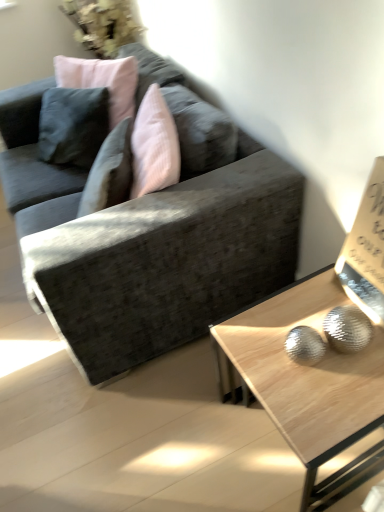
Question: Can you confirm if white paper at upper right is smaller than textured gray couch at center?

Choices:
 (A) yes
 (B) no

Answer: (A)

Question: From the image's perspective, is white paper at upper right below textured gray couch at center?

Choices:
 (A) no
 (B) yes

Answer: (B)

Question: Is white paper at upper right bigger than textured gray couch at center?

Choices:
 (A) yes
 (B) no

Answer: (B)

Question: Can you confirm if white paper at upper right is taller than textured gray couch at center?

Choices:
 (A) yes
 (B) no

Answer: (B)

Question: Is white paper at upper right far away from textured gray couch at center?

Choices:
 (A) no
 (B) yes

Answer: (A)

Question: From the image's perspective, relative to white paper at upper right, is textured gray couch at center above or below?

Choices:
 (A) above
 (B) below

Answer: (A)

Question: Would you say textured gray couch at center is inside or outside white paper at upper right?

Choices:
 (A) outside
 (B) inside

Answer: (A)

Question: Is textured gray couch at center taller or shorter than white paper at upper right?

Choices:
 (A) tall
 (B) short

Answer: (A)

Question: Is point (66, 304) closer or farther from the camera than point (349, 261)?

Choices:
 (A) farther
 (B) closer

Answer: (A)

Question: Which is correct: light wood/texture coffee table at lower right is inside white paper at upper right, or outside of it?

Choices:
 (A) inside
 (B) outside

Answer: (B)

Question: Is point (309, 453) closer or farther from the camera than point (370, 218)?

Choices:
 (A) farther
 (B) closer

Answer: (B)

Question: Looking at the image, does light wood/texture coffee table at lower right seem bigger or smaller compared to white paper at upper right?

Choices:
 (A) small
 (B) big

Answer: (B)

Question: Is light wood/texture coffee table at lower right wider or thinner than white paper at upper right?

Choices:
 (A) wide
 (B) thin

Answer: (A)

Question: Looking at the image, does light wood/texture coffee table at lower right seem bigger or smaller compared to textured gray couch at center?

Choices:
 (A) small
 (B) big

Answer: (A)

Question: Considering the positions of light wood/texture coffee table at lower right and textured gray couch at center in the image, is light wood/texture coffee table at lower right taller or shorter than textured gray couch at center?

Choices:
 (A) short
 (B) tall

Answer: (A)